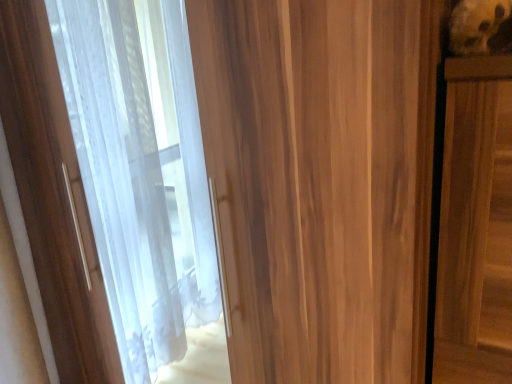
This screenshot has height=384, width=512. In order to click on translucent fabric curtain at center in this screenshot , I will do `click(321, 181)`.

The width and height of the screenshot is (512, 384). What do you see at coordinates (321, 181) in the screenshot?
I see `translucent fabric curtain at center` at bounding box center [321, 181].

Locate an element on the screen. Image resolution: width=512 pixels, height=384 pixels. translucent fabric curtain at center is located at coordinates (321, 181).